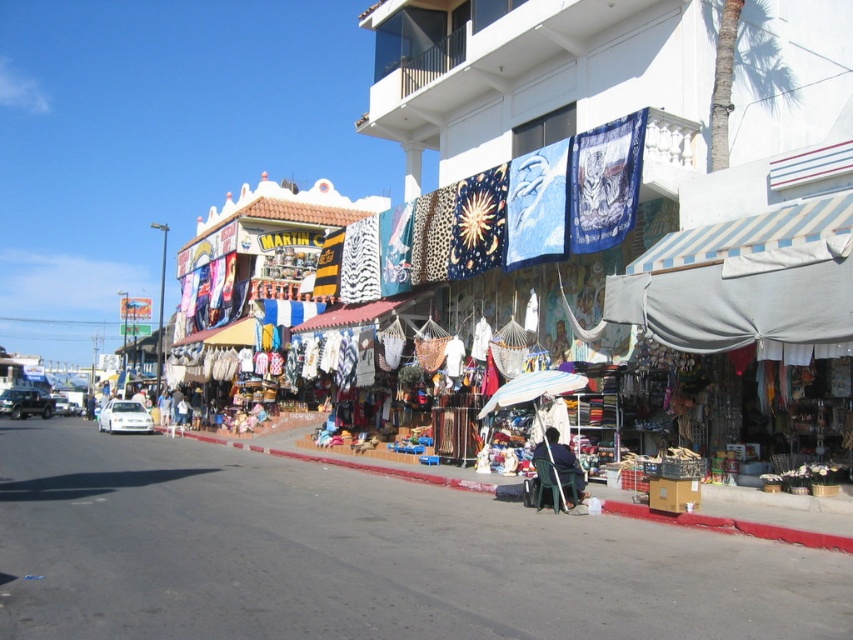
You are a pedestrian standing on the road and looking towards the shops. You see the white fabric umbrella at center and the dark blue fabric at center. Which one is higher from the ground?

The white fabric umbrella at center is above the dark blue fabric at center, so it is higher from the ground.

You are a customer walking down the street and want to see both the white fabric umbrella at center and the dark blue fabric at center. Which one would you need to look behind the other to see?

To see both the white fabric umbrella at center and the dark blue fabric at center, you would need to look behind the white fabric umbrella at center because the dark blue fabric at center is positioned behind it.